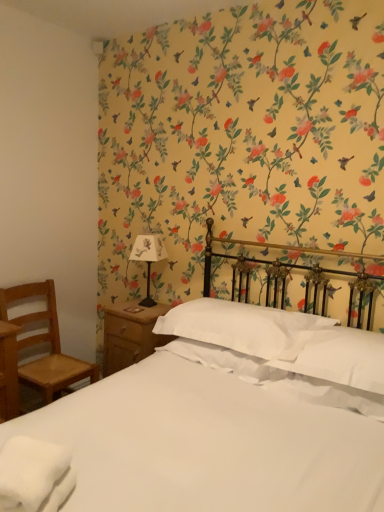
Question: From the image's perspective, does white soft pillow at center, the first pillow in the right-to-left sequence, appear higher than white paper lampshade at upper left?

Choices:
 (A) no
 (B) yes

Answer: (A)

Question: Is white soft pillow at center, which ranks as the 2th pillow in left-to-right order, looking in the opposite direction of white paper lampshade at upper left?

Choices:
 (A) no
 (B) yes

Answer: (A)

Question: From the image's perspective, is white soft pillow at center, the first pillow in the right-to-left sequence, below white paper lampshade at upper left?

Choices:
 (A) no
 (B) yes

Answer: (B)

Question: Is white paper lampshade at upper left surrounded by white soft pillow at center, which ranks as the 2th pillow in left-to-right order?

Choices:
 (A) yes
 (B) no

Answer: (B)

Question: From a real-world perspective, is white soft pillow at center, which ranks as the 2th pillow in left-to-right order, over white paper lampshade at upper left?

Choices:
 (A) no
 (B) yes

Answer: (A)

Question: From a real-world perspective, is white soft towel at lower left physically located above or below white soft pillow at center, which ranks as the 2th pillow in left-to-right order?

Choices:
 (A) below
 (B) above

Answer: (A)

Question: In terms of size, does white soft towel at lower left appear bigger or smaller than white soft pillow at center, which ranks as the 2th pillow in left-to-right order?

Choices:
 (A) small
 (B) big

Answer: (A)

Question: Is white soft towel at lower left to the left or to the right of white soft pillow at center, which ranks as the 2th pillow in left-to-right order, in the image?

Choices:
 (A) right
 (B) left

Answer: (B)

Question: In terms of height, does white soft towel at lower left look taller or shorter compared to white soft pillow at center, the first pillow in the right-to-left sequence?

Choices:
 (A) tall
 (B) short

Answer: (B)

Question: Based on their positions, is white soft pillow at center, the first pillow in the right-to-left sequence, located to the left or right of wooden chair at left?

Choices:
 (A) left
 (B) right

Answer: (B)

Question: From the image's perspective, is white soft pillow at center, the first pillow in the right-to-left sequence, located above or below wooden chair at left?

Choices:
 (A) below
 (B) above

Answer: (B)

Question: Is white soft pillow at center, which ranks as the 2th pillow in left-to-right order, wider or thinner than wooden chair at left?

Choices:
 (A) thin
 (B) wide

Answer: (B)

Question: Considering their positions, is white soft pillow at center, the first pillow in the right-to-left sequence, located in front of or behind wooden chair at left?

Choices:
 (A) behind
 (B) front

Answer: (B)

Question: Is white soft pillow at center, the 1th pillow when ordered from left to right, to the left or to the right of white soft towel at lower left in the image?

Choices:
 (A) left
 (B) right

Answer: (B)

Question: Considering the positions of white soft pillow at center, the 2th pillow positioned from the right, and white soft towel at lower left in the image, is white soft pillow at center, the 2th pillow positioned from the right, wider or thinner than white soft towel at lower left?

Choices:
 (A) wide
 (B) thin

Answer: (A)